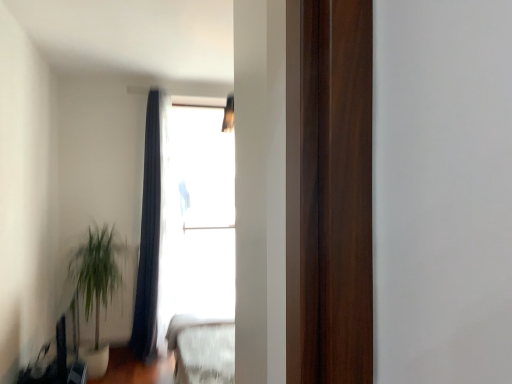
Measure the distance between point (71, 274) and camera.

The depth of point (71, 274) is 3.75 meters.

In order to face transparent glass window at upper center, should I rotate leftwards or rightwards?

Turn left approximately 7.370 degrees to face it.

Find the location of `green leafy plant at lower left`. green leafy plant at lower left is located at coordinates (95, 288).

Is point (74, 269) farther from viewer compared to point (231, 142)?

No, (74, 269) is closer to viewer.

Considering the relative positions of green leafy plant at lower left and transparent glass window at upper center in the image provided, is green leafy plant at lower left to the left of transparent glass window at upper center from the viewer's perspective?

Correct, you'll find green leafy plant at lower left to the left of transparent glass window at upper center.

Are green leafy plant at lower left and transparent glass window at upper center making contact?

No, green leafy plant at lower left is not touching transparent glass window at upper center.

In the scene shown: Which object is closer to the camera, green leafy plant at lower left or transparent glass window at upper center?

green leafy plant at lower left.

Considering the relative sizes of green leafy plant at lower left and dark blue fabric curtain at upper center in the image provided, is green leafy plant at lower left wider than dark blue fabric curtain at upper center?

Indeed, green leafy plant at lower left has a greater width compared to dark blue fabric curtain at upper center.

Is green leafy plant at lower left positioned in front of dark blue fabric curtain at upper center?

Yes, the depth of green leafy plant at lower left is less than that of dark blue fabric curtain at upper center.

Which is more to the right, green leafy plant at lower left or dark blue fabric curtain at upper center?

Positioned to the right is dark blue fabric curtain at upper center.

Between green leafy plant at lower left and dark blue fabric curtain at upper center, which one has more height?

Standing taller between the two is dark blue fabric curtain at upper center.

Can you tell me how much transparent glass window at upper center and green leafy plant at lower left differ in facing direction?

91.3 degrees.

Who is smaller, transparent glass window at upper center or green leafy plant at lower left?

transparent glass window at upper center.

Do you think transparent glass window at upper center is within green leafy plant at lower left, or outside of it?

transparent glass window at upper center is outside green leafy plant at lower left.

Considering the sizes of objects transparent glass window at upper center and green leafy plant at lower left in the image provided, who is wider, transparent glass window at upper center or green leafy plant at lower left?

Wider between the two is green leafy plant at lower left.

Which of these two, dark blue fabric curtain at upper center or green leafy plant at lower left, is bigger?

green leafy plant at lower left.

Is dark blue fabric curtain at upper center located outside green leafy plant at lower left?

Yes, dark blue fabric curtain at upper center is located beyond the bounds of green leafy plant at lower left.

From the picture: Which object is thinner, dark blue fabric curtain at upper center or green leafy plant at lower left?

dark blue fabric curtain at upper center is thinner.

Which object is positioned more to the right, transparent glass window at upper center or dark blue fabric curtain at upper center?

From the viewer's perspective, transparent glass window at upper center appears more on the right side.

How far apart are transparent glass window at upper center and dark blue fabric curtain at upper center?

transparent glass window at upper center is 21.63 inches away from dark blue fabric curtain at upper center.

Would you consider transparent glass window at upper center to be distant from dark blue fabric curtain at upper center?

No, transparent glass window at upper center is in close proximity to dark blue fabric curtain at upper center.

Is the depth of transparent glass window at upper center less than that of dark blue fabric curtain at upper center?

No, transparent glass window at upper center is behind dark blue fabric curtain at upper center.

The image size is (512, 384). I want to click on curtain in front of the transparent glass window at upper center, so click(150, 230).

Which of these two, dark blue fabric curtain at upper center or transparent glass window at upper center, is wider?

Wider between the two is dark blue fabric curtain at upper center.

Is transparent glass window at upper center completely or partially inside dark blue fabric curtain at upper center?

No, transparent glass window at upper center is not inside dark blue fabric curtain at upper center.

From the image's perspective, is dark blue fabric curtain at upper center located above or below transparent glass window at upper center?

Based on their image positions, dark blue fabric curtain at upper center is located beneath transparent glass window at upper center.

The image size is (512, 384). Identify the location of houseplant on the left of the transparent glass window at upper center. (95, 288).

Locate an element on the screen. houseplant below the dark blue fabric curtain at upper center (from the image's perspective) is located at coordinates (95, 288).

Considering their positions, is dark blue fabric curtain at upper center positioned further to green leafy plant at lower left than transparent glass window at upper center?

transparent glass window at upper center is positioned further to the anchor green leafy plant at lower left.

Based on their spatial positions, is green leafy plant at lower left or transparent glass window at upper center further from dark blue fabric curtain at upper center?

Based on the image, green leafy plant at lower left appears to be further to dark blue fabric curtain at upper center.

Which object lies nearer to the anchor point green leafy plant at lower left, transparent glass window at upper center or dark blue fabric curtain at upper center?

The object closer to green leafy plant at lower left is dark blue fabric curtain at upper center.

When comparing their distances from transparent glass window at upper center, does green leafy plant at lower left or dark blue fabric curtain at upper center seem closer?

The object closer to transparent glass window at upper center is dark blue fabric curtain at upper center.

Looking at the image, which one is located closer to transparent glass window at upper center, dark blue fabric curtain at upper center or green leafy plant at lower left?

Among the two, dark blue fabric curtain at upper center is located nearer to transparent glass window at upper center.

Considering their positions, is transparent glass window at upper center positioned further to dark blue fabric curtain at upper center than green leafy plant at lower left?

Among the two, green leafy plant at lower left is located further to dark blue fabric curtain at upper center.

The width and height of the screenshot is (512, 384). I want to click on curtain between green leafy plant at lower left and transparent glass window at upper center along the z-axis, so click(150, 230).